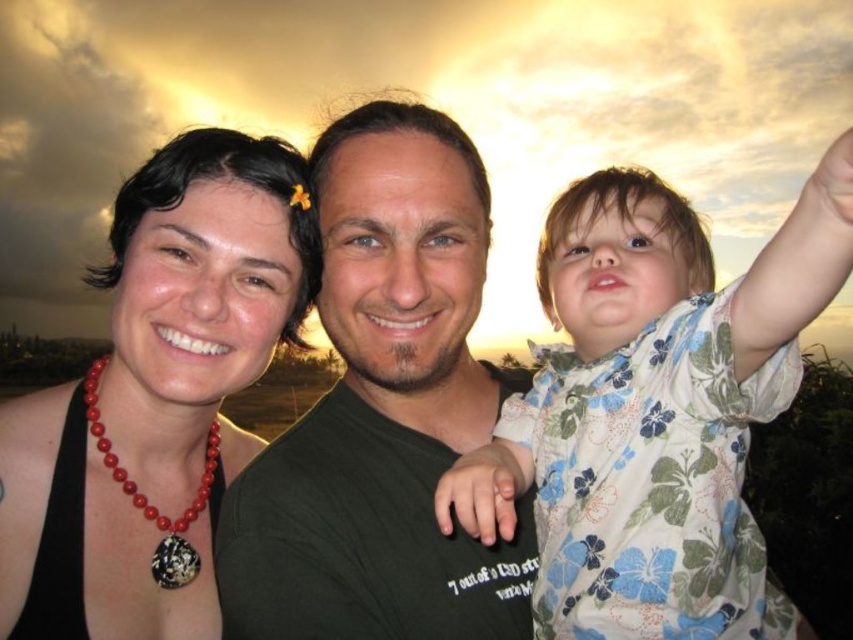
You are a photographer trying to focus on the floral fabric shirt at right and the matte coral necklace at upper left. Which object should you adjust your camera to focus on first if you want to capture both in the same frame?

The floral fabric shirt at right is located above the matte coral necklace at upper left, so you should focus on the floral fabric shirt at right first to ensure both are in the frame.

You are a photographer adjusting the lighting for a closeup shot of the two necklaces. The camera lens can only focus on objects within a 18 inch range. Given their current positions, will the camera be able to capture both the matte coral necklace at upper left and the red beaded necklace at left in focus?

The distance between the matte coral necklace at upper left and the red beaded necklace at left is 19.18 inches. Since the camera can only focus within an 18 inch range, the camera will not be able to capture both necklaces in focus simultaneously.